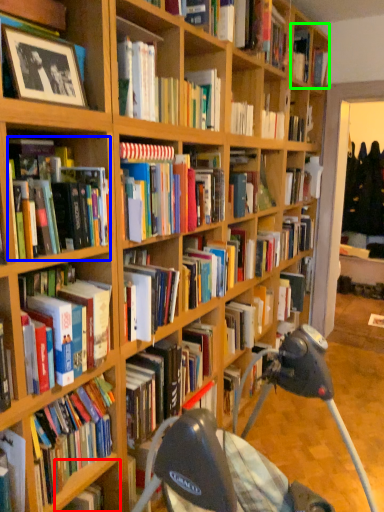
Question: Which is nearer to the shelf (highlighted by a red box)? book (highlighted by a blue box) or book (highlighted by a green box).

Choices:
 (A) book
 (B) book

Answer: (A)